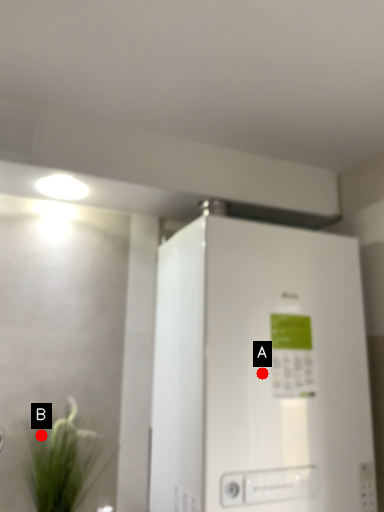
Question: Two points are circled on the image, labeled by A and B beside each circle. Which point is closer to the camera?

Choices:
 (A) A is closer
 (B) B is closer

Answer: (A)